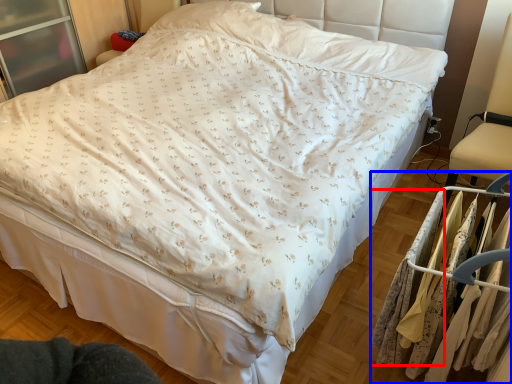
Question: Which point is closer to the camera, clothing (highlighted by a red box) or closet (highlighted by a blue box)?

Choices:
 (A) clothing
 (B) closet

Answer: (B)